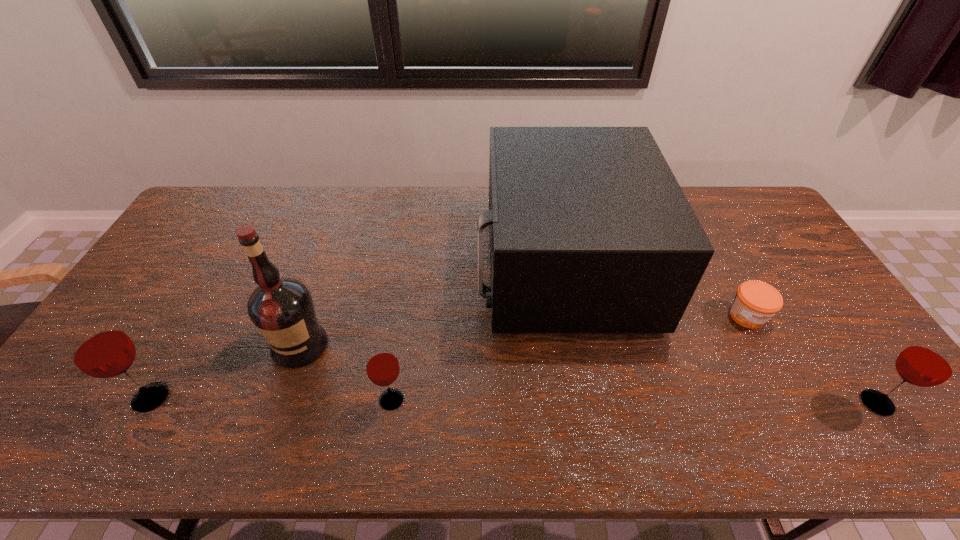
Identify the location of the leftmost glass. (98, 348).

This screenshot has height=540, width=960. In order to click on the second glass from right to left in this screenshot , I will do `click(382, 367)`.

Find the location of a particular element. Image resolution: width=960 pixels, height=540 pixels. the shortest glass is located at coordinates (382, 367).

This screenshot has height=540, width=960. I want to click on the rightmost object, so click(931, 361).

Where is `the second tallest glass`? the second tallest glass is located at coordinates (931, 361).

You are a GUI agent. You are given a task and a screenshot of the screen. Output one action in this format:
    pyautogui.click(x=<x>, y=<y>)
    Task: Click on the third object from right to left
    The width and height of the screenshot is (960, 540).
    Given the screenshot: What is the action you would take?
    pyautogui.click(x=590, y=232)

You are a GUI agent. You are given a task and a screenshot of the screen. Output one action in this format:
    pyautogui.click(x=<x>, y=<y>)
    Task: Click on the microwave oven
    The height and width of the screenshot is (540, 960).
    Given the screenshot: What is the action you would take?
    pyautogui.click(x=590, y=232)

Locate an element on the screen. The image size is (960, 540). the tallest object is located at coordinates (281, 308).

Image resolution: width=960 pixels, height=540 pixels. I want to click on liquor, so click(281, 308).

At what (x,y) coordinates should I click in order to perform the action: click on jam. Please return your answer as a coordinate pair (x, y). Looking at the image, I should click on (755, 302).